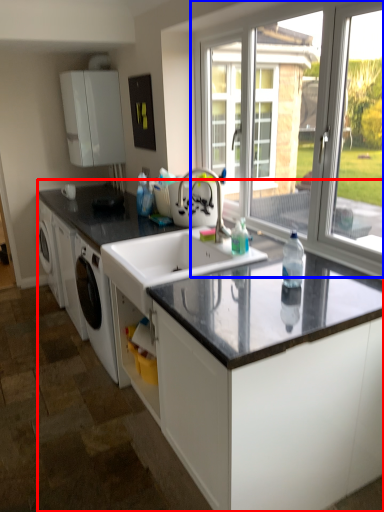
Question: Which of the following is the closest to the observer, countertop (highlighted by a red box) or window (highlighted by a blue box)?

Choices:
 (A) countertop
 (B) window

Answer: (A)